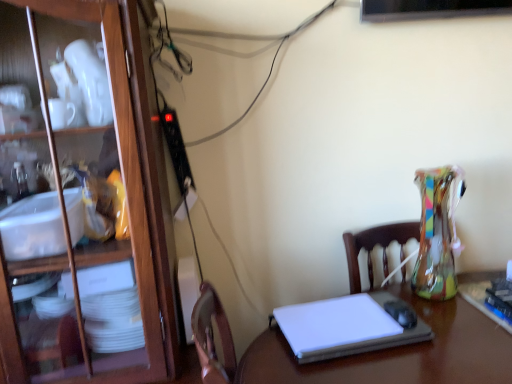
In the scene shown: What is the approximate width of wooden cabinet at left?

It is 47.44 centimeters.

Where is `white matte laptop at center`? The image size is (512, 384). white matte laptop at center is located at coordinates (345, 327).

Image resolution: width=512 pixels, height=384 pixels. Identify the location of wooden cabinet at left. (122, 176).

Can we say wooden cabinet at left lies outside white matte laptop at center?

Yes, wooden cabinet at left is outside of white matte laptop at center.

From the image's perspective, which one is positioned higher, wooden cabinet at left or white matte laptop at center?

wooden cabinet at left is shown above in the image.

Does point (82, 11) come behind point (410, 329)?

That is False.

How different are the orientations of wooden cabinet at left and white matte laptop at center in degrees?

The angle between the facing direction of wooden cabinet at left and the facing direction of white matte laptop at center is 4.15 degrees.

Considering the positions of point (314, 330) and point (154, 276), is point (314, 330) closer or farther from the camera than point (154, 276)?

Point (314, 330) is farther from the camera than point (154, 276).

Is white matte laptop at center shorter than wooden cabinet at left?

Correct, white matte laptop at center is not as tall as wooden cabinet at left.

Does white glossy desk at center have a smaller size compared to white matte laptop at center?

Incorrect, white glossy desk at center is not smaller in size than white matte laptop at center.

From the picture: Is white glossy desk at center taller than white matte laptop at center?

Indeed, white glossy desk at center has a greater height compared to white matte laptop at center.

Between point (398, 368) and point (342, 307), which one is positioned in front?

Point (398, 368)

Considering the sizes of objects white glossy desk at center and white matte laptop at center in the image provided, who is wider, white glossy desk at center or white matte laptop at center?

white glossy desk at center.

Would you say wooden cabinet at left is outside white glossy desk at center?

wooden cabinet at left is positioned outside white glossy desk at center.

Is wooden cabinet at left to the left or to the right of white glossy desk at center in the image?

Based on their positions, wooden cabinet at left is located to the left of white glossy desk at center.

Is wooden cabinet at left wider or thinner than white glossy desk at center?

wooden cabinet at left is thinner than white glossy desk at center.

Which object is further away from the camera taking this photo, wooden cabinet at left or white glossy desk at center?

wooden cabinet at left is behind.

Is point (430, 325) farther from camera compared to point (73, 366)?

Yes, it is.

Is white glossy desk at center not inside wooden cabinet at left?

Absolutely, white glossy desk at center is external to wooden cabinet at left.

You are a GUI agent. You are given a task and a screenshot of the screen. Output one action in this format:
    pyautogui.click(x=<x>, y=<y>)
    Task: Click on the cabinetry that is on the left side of white glossy desk at center
    
    Given the screenshot: What is the action you would take?
    pyautogui.click(x=122, y=176)

Between white matte laptop at center and white glossy desk at center, which one is positioned behind?

Positioned behind is white matte laptop at center.

Is white matte laptop at center not close to white glossy desk at center?

No, white matte laptop at center is in close proximity to white glossy desk at center.

Considering the relative sizes of white matte laptop at center and white glossy desk at center in the image provided, is white matte laptop at center thinner than white glossy desk at center?

Indeed, white matte laptop at center has a lesser width compared to white glossy desk at center.

Does point (322, 305) come behind point (446, 355)?

Yes.

Image resolution: width=512 pixels, height=384 pixels. In order to click on cabinetry located on the left of white matte laptop at center in this screenshot , I will do `click(122, 176)`.

At what (x,y) coordinates should I click in order to perform the action: click on cabinetry above the white matte laptop at center (from a real-world perspective). Please return your answer as a coordinate pair (x, y). The width and height of the screenshot is (512, 384). Looking at the image, I should click on (122, 176).

Based on their spatial positions, is wooden cabinet at left or white glossy desk at center closer to white matte laptop at center?

white glossy desk at center is closer to white matte laptop at center.

When comparing their distances from white matte laptop at center, does white glossy desk at center or wooden cabinet at left seem further?

wooden cabinet at left.

Which object lies further to the anchor point wooden cabinet at left, white matte laptop at center or white glossy desk at center?

Among the two, white glossy desk at center is located further to wooden cabinet at left.

Looking at the image, which one is located further to white glossy desk at center, wooden cabinet at left or white matte laptop at center?

wooden cabinet at left.

Which object lies further to the anchor point white glossy desk at center, white matte laptop at center or wooden cabinet at left?

wooden cabinet at left lies further to white glossy desk at center than the other object.

Which object lies nearer to the anchor point wooden cabinet at left, white glossy desk at center or white matte laptop at center?

white matte laptop at center is closer to wooden cabinet at left.

You are a GUI agent. You are given a task and a screenshot of the screen. Output one action in this format:
    pyautogui.click(x=<x>, y=<y>)
    Task: Click on the desk between wooden cabinet at left and white matte laptop at center
    The height and width of the screenshot is (384, 512).
    Given the screenshot: What is the action you would take?
    pyautogui.click(x=396, y=352)